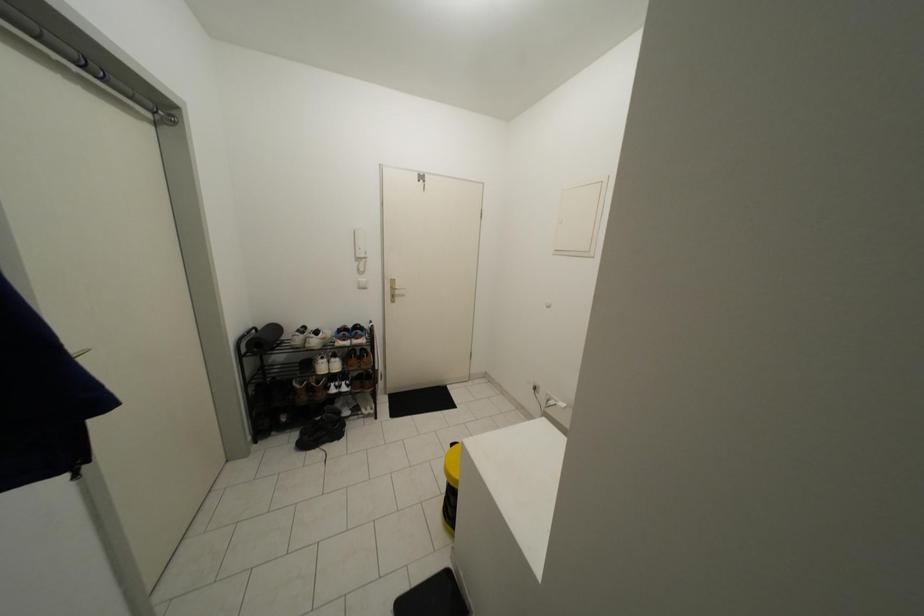
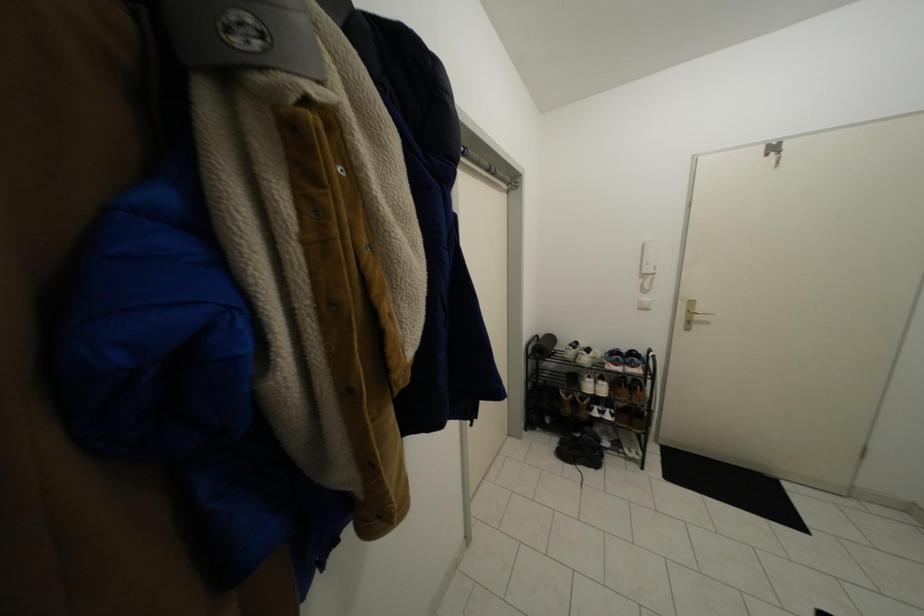
Question: The camera is either moving clockwise (left) or counter-clockwise (right) around the object. The first image is from the beginning of the video and the second image is from the end. Is the camera moving left or right when shooting the video?

Choices:
 (A) Left
 (B) Right

Answer: (B)